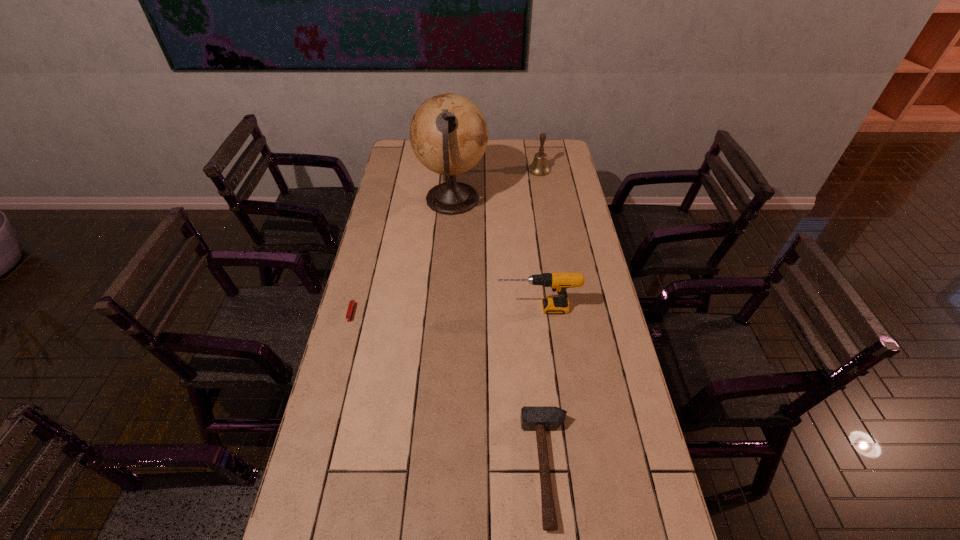
This screenshot has width=960, height=540. In order to click on bell present at the right edge in this screenshot , I will do `click(539, 167)`.

The height and width of the screenshot is (540, 960). I want to click on drill positioned at the right edge, so click(x=559, y=282).

In order to click on object situated at the far right corner in this screenshot , I will do pos(539,167).

Locate an element on the screen. vacant space at the far edge is located at coordinates (528, 159).

In the image, there is a desktop. At what (x,y) coordinates should I click in order to perform the action: click on free region at the left edge. Please return your answer as a coordinate pair (x, y). Image resolution: width=960 pixels, height=540 pixels. Looking at the image, I should click on (375, 332).

Where is `free space at the right edge of the desktop`? Image resolution: width=960 pixels, height=540 pixels. free space at the right edge of the desktop is located at coordinates (557, 237).

At what (x,y) coordinates should I click in order to perform the action: click on vacant space at the far left corner of the desktop. Please return your answer as a coordinate pair (x, y). The width and height of the screenshot is (960, 540). Looking at the image, I should click on (406, 147).

In the image, there is a desktop. In order to click on free region at the far right corner in this screenshot , I will do point(553,161).

Where is `vacant region between the tallest object and the bell`? Image resolution: width=960 pixels, height=540 pixels. vacant region between the tallest object and the bell is located at coordinates (495, 185).

Identify the location of vacant space that's between the tallest object and the second shortest object. (500, 334).